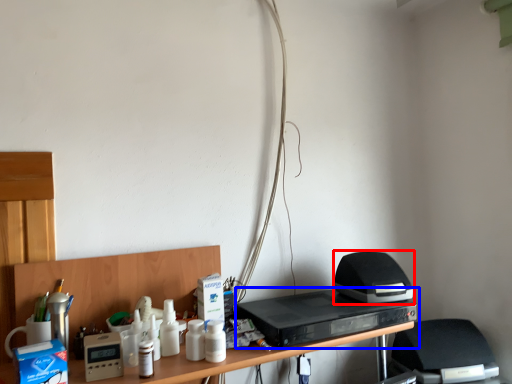
Question: Which object is closer to the camera taking this photo, appliance (highlighted by a red box) or home appliance (highlighted by a blue box)?

Choices:
 (A) appliance
 (B) home appliance

Answer: (B)